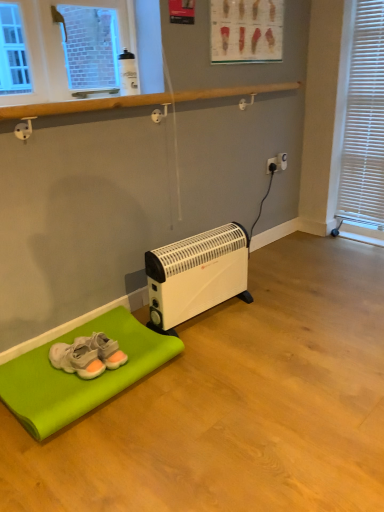
Question: From a real-world perspective, is white plastic electric outlet at center-right, placed as the second electric outlet when sorted from left to right, under white plastic heater at lower center?

Choices:
 (A) yes
 (B) no

Answer: (B)

Question: Is white plastic heater at lower center a part of white plastic electric outlet at center-right, which is the 1th electric outlet from right to left?

Choices:
 (A) no
 (B) yes

Answer: (A)

Question: Is white plastic electric outlet at center-right, placed as the second electric outlet when sorted from left to right, not within white plastic heater at lower center?

Choices:
 (A) yes
 (B) no

Answer: (A)

Question: Does white plastic electric outlet at center-right, placed as the second electric outlet when sorted from left to right, have a larger size compared to white plastic heater at lower center?

Choices:
 (A) no
 (B) yes

Answer: (A)

Question: Considering the relative sizes of white plastic electric outlet at center-right, placed as the second electric outlet when sorted from left to right, and white plastic heater at lower center in the image provided, is white plastic electric outlet at center-right, placed as the second electric outlet when sorted from left to right, shorter than white plastic heater at lower center?

Choices:
 (A) yes
 (B) no

Answer: (A)

Question: Is white plastic electric outlet at center-right, placed as the second electric outlet when sorted from left to right, inside the boundaries of white plastic blinds at right, or outside?

Choices:
 (A) outside
 (B) inside

Answer: (A)

Question: Considering the positions of point (281, 165) and point (360, 150), is point (281, 165) closer or farther from the camera than point (360, 150)?

Choices:
 (A) closer
 (B) farther

Answer: (B)

Question: Visually, is white plastic electric outlet at center-right, placed as the second electric outlet when sorted from left to right, positioned to the left or to the right of white plastic blinds at right?

Choices:
 (A) left
 (B) right

Answer: (A)

Question: From a real-world perspective, relative to white plastic blinds at right, is white plastic electric outlet at center-right, which is the 1th electric outlet from right to left, vertically above or below?

Choices:
 (A) above
 (B) below

Answer: (B)

Question: Is point (365, 129) closer or farther from the camera than point (49, 413)?

Choices:
 (A) closer
 (B) farther

Answer: (B)

Question: Choose the correct answer: Is white plastic blinds at right inside green fabric mat at lower left or outside it?

Choices:
 (A) outside
 (B) inside

Answer: (A)

Question: In terms of size, does white plastic blinds at right appear bigger or smaller than green fabric mat at lower left?

Choices:
 (A) small
 (B) big

Answer: (B)

Question: From the image's perspective, is white plastic blinds at right above or below green fabric mat at lower left?

Choices:
 (A) above
 (B) below

Answer: (A)

Question: Is point (92, 332) positioned closer to the camera than point (81, 402)?

Choices:
 (A) farther
 (B) closer

Answer: (A)

Question: Is gray suede sneakers at lower left bigger or smaller than green fabric mat at lower left?

Choices:
 (A) big
 (B) small

Answer: (B)